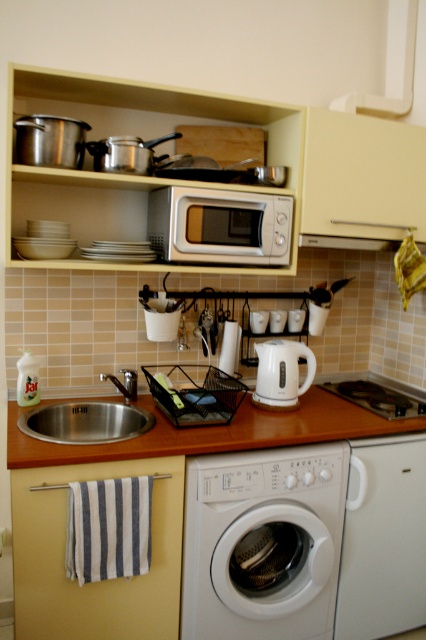
You are organizing the kitchen and need to place a new appliance that requires 15 cm of vertical space. You have two options available in the scene, the matte white microwave at upper center and the white glossy electric kettle at center. Which appliance can you place in a space that is only 15 cm tall?

The white glossy electric kettle at center is shorter than the matte white microwave at upper center, so it can fit into the 15 cm tall space.

You are organizing the kitchen and need to move the wooden at center to access the silver metallic microwave at center. Based on their positions, is this possible without moving the microwave?

Yes, because the wooden at center is in front of the silver metallic microwave at center, you can move it out of the way to access the microwave without moving the microwave itself.

You are organizing the kitchen and need to place a new spice rack that requires 15 cm of vertical space. You have two options for placement between the wooden at center and the silver metallic microwave at center. Which object can accommodate the spice rack based on their heights?

The wooden at center is shorter than the silver metallic microwave at center. Therefore, the spice rack requiring 15 cm of vertical space can be placed on the wooden at center since it has less height and might have more available space above it.